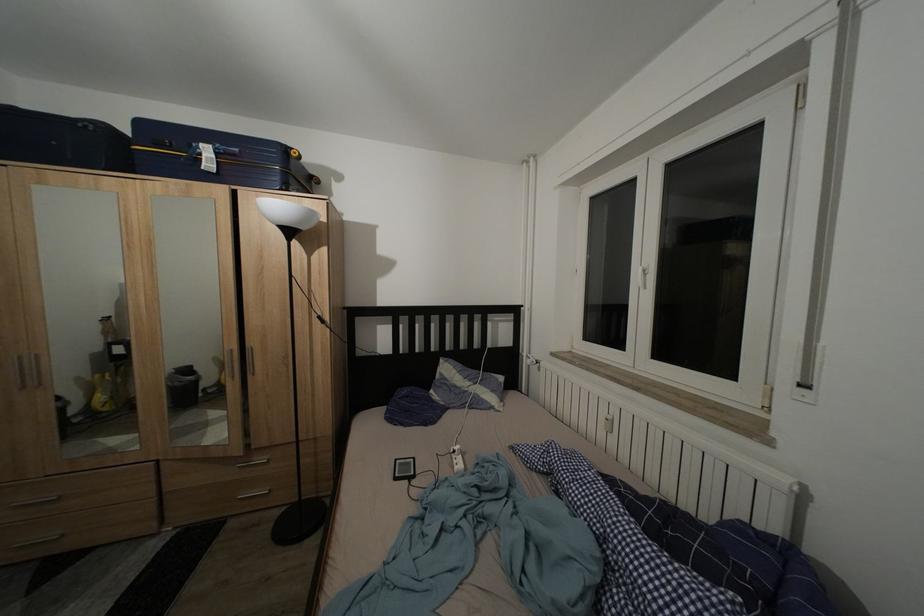
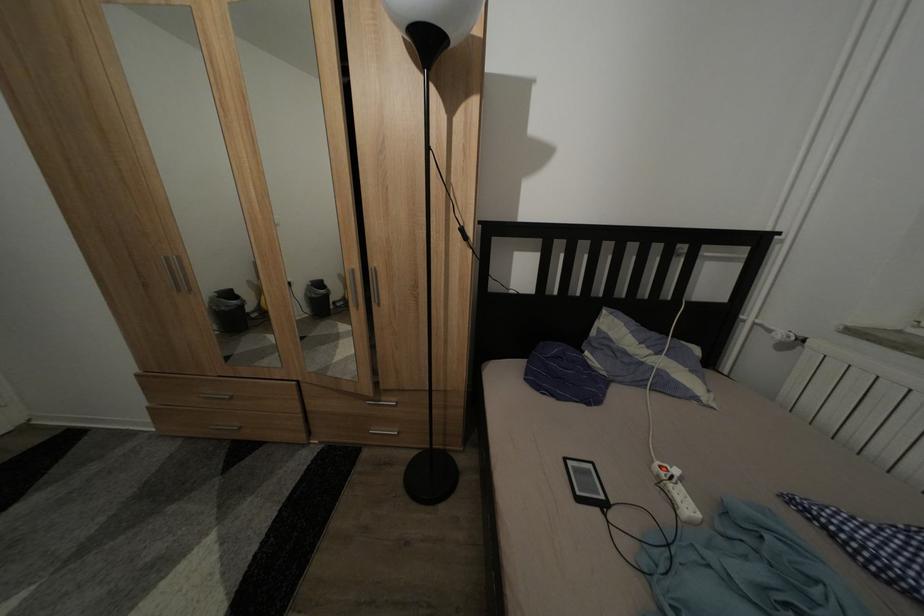
In the second image, find the point that corresponds to the point at 223,365 in the first image.

(347, 282)